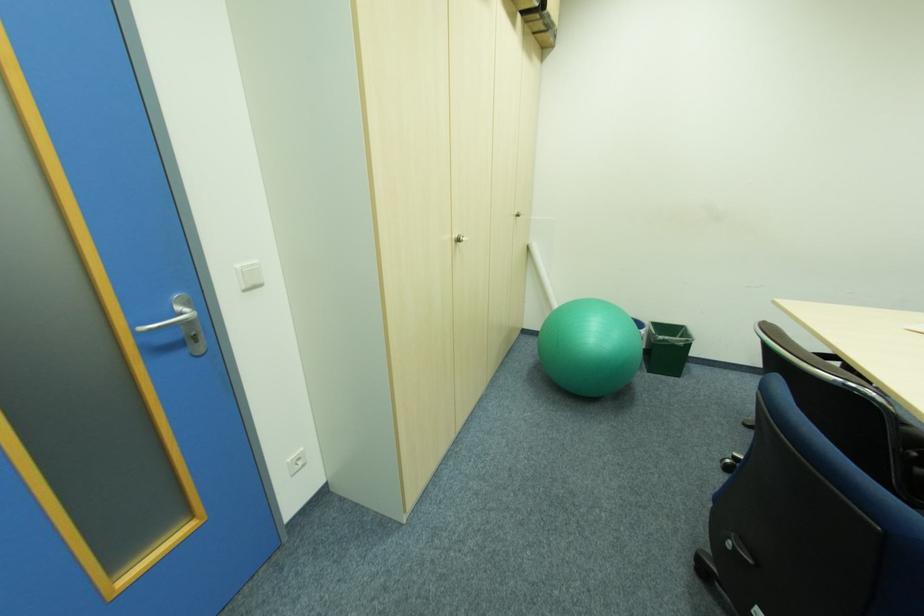
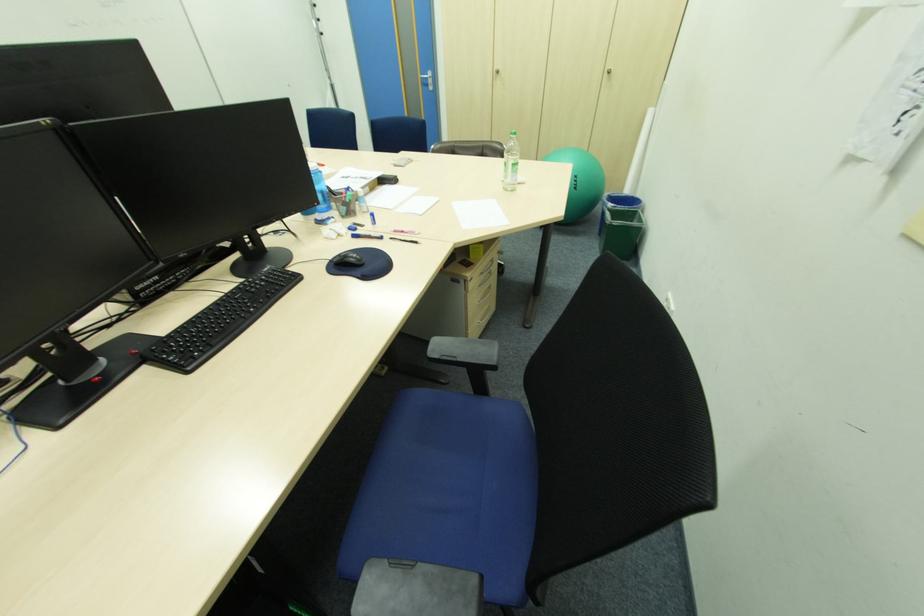
Locate, in the second image, the point that corresponds to point (144, 334) in the first image.

(428, 79)